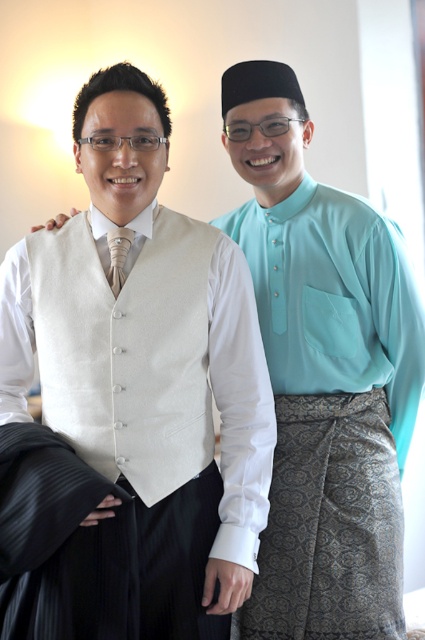
Question: Which point is closer to the camera?

Choices:
 (A) beige wool vest at center
 (B) matte silk tie at center

Answer: (A)

Question: Is beige wool vest at center positioned before matte silk tie at center?

Choices:
 (A) yes
 (B) no

Answer: (A)

Question: Does beige wool vest at center have a greater width compared to matte silk tie at center?

Choices:
 (A) yes
 (B) no

Answer: (A)

Question: Is beige wool vest at center below matte silk tie at center?

Choices:
 (A) yes
 (B) no

Answer: (A)